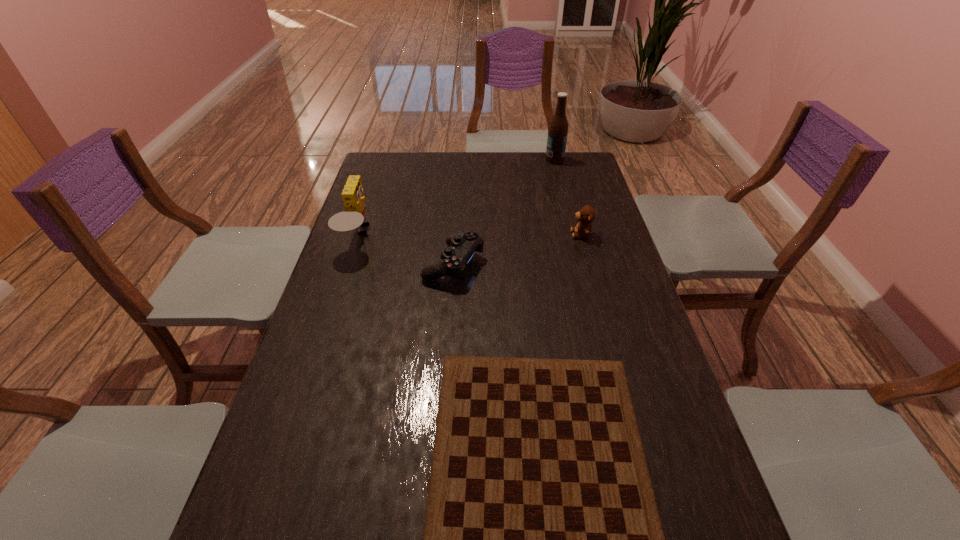
This screenshot has height=540, width=960. In order to click on the farthest object in this screenshot , I will do `click(558, 129)`.

Identify the location of the tallest object. (558, 129).

Identify the location of the leftmost object. (352, 218).

Where is `sponge`? The width and height of the screenshot is (960, 540). sponge is located at coordinates (352, 218).

Where is `the third tallest object`? This screenshot has width=960, height=540. the third tallest object is located at coordinates (586, 215).

At what (x,y) coordinates should I click in order to perform the action: click on the fourth tallest object. Please return your answer as a coordinate pair (x, y). This screenshot has height=540, width=960. Looking at the image, I should click on (454, 259).

Where is `free space located on the front of the tallest object`? free space located on the front of the tallest object is located at coordinates (563, 191).

You are a GUI agent. You are given a task and a screenshot of the screen. Output one action in this format:
    pyautogui.click(x=<x>, y=<y>)
    Task: Click on the blank area located 0.350m on the front-facing side of the leftmost object
    This screenshot has height=540, width=960.
    Given the screenshot: What is the action you would take?
    pyautogui.click(x=480, y=236)

This screenshot has height=540, width=960. In order to click on free space located on the face of the third shortest object in this screenshot , I will do `click(474, 234)`.

Identify the location of free space located 0.360m on the face of the third shortest object. (463, 234).